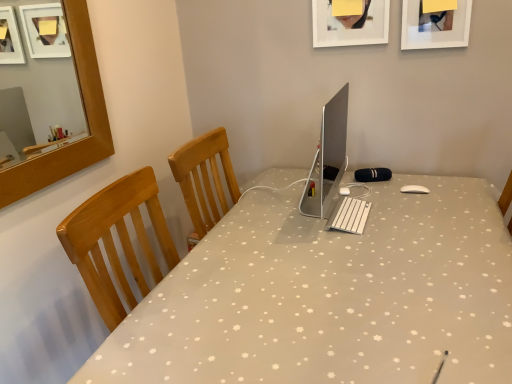
Question: Relative to matte white picture frame at upper center, which is the first picture frame in left-to-right order, is white fabric desk at center in front or behind?

Choices:
 (A) front
 (B) behind

Answer: (A)

Question: Is white fabric desk at center to the left or to the right of matte white picture frame at upper center, the 2th picture frame from the right, in the image?

Choices:
 (A) left
 (B) right

Answer: (A)

Question: Which object is the farthest from the silver metallic computer monitor at center?

Choices:
 (A) white plastic keyboard at center
 (B) white fabric desk at center
 (C) white matte picture frame at upper right, the 2th picture frame positioned from the left
 (D) matte white picture frame at upper center, which is the first picture frame in left-to-right order

Answer: (C)

Question: Which object is positioned farthest from the matte white picture frame at upper center, which is the first picture frame in left-to-right order?

Choices:
 (A) white matte picture frame at upper right, the 2th picture frame positioned from the left
 (B) white fabric desk at center
 (C) white plastic keyboard at center
 (D) silver metallic computer monitor at center

Answer: (B)